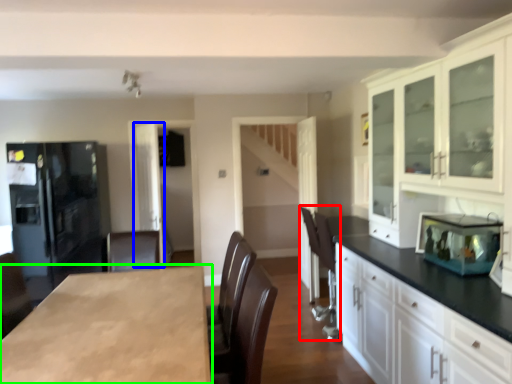
Question: Estimate the real-world distances between objects in this image. Which object is farther from armchair (highlighted by a red box), glass door (highlighted by a blue box) or countertop (highlighted by a green box)?

Choices:
 (A) glass door
 (B) countertop

Answer: (A)